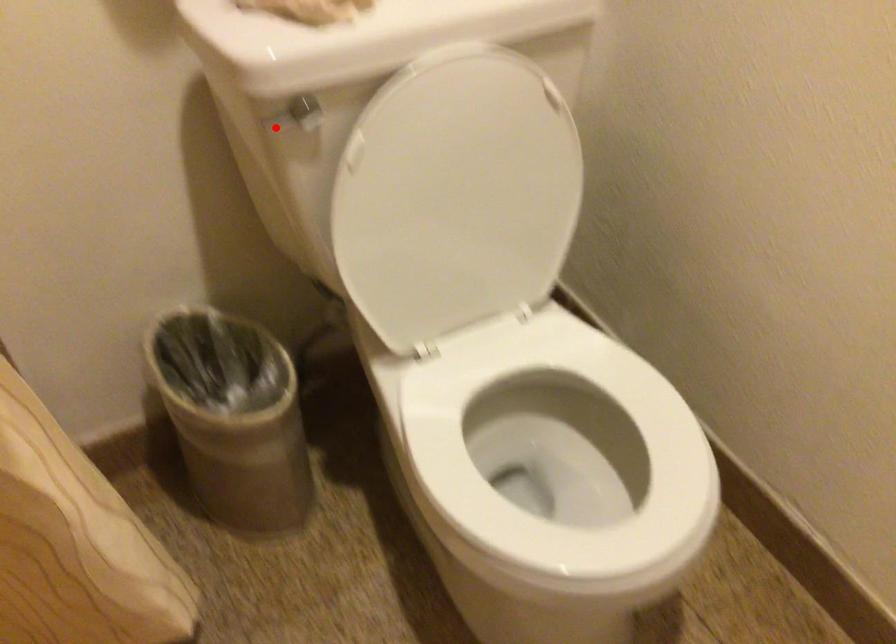
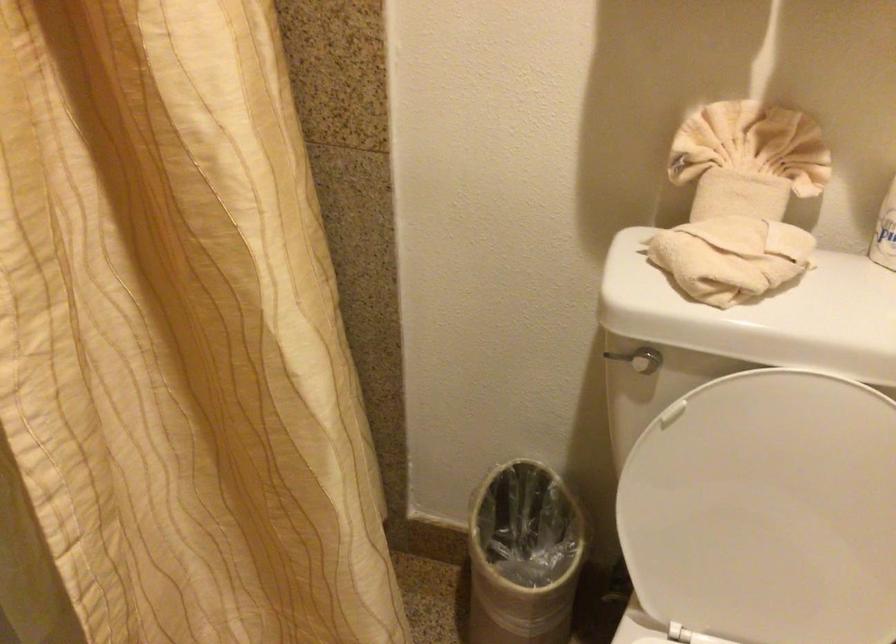
Locate, in the second image, the point that corresponds to the highlighted location in the first image.

(616, 357)